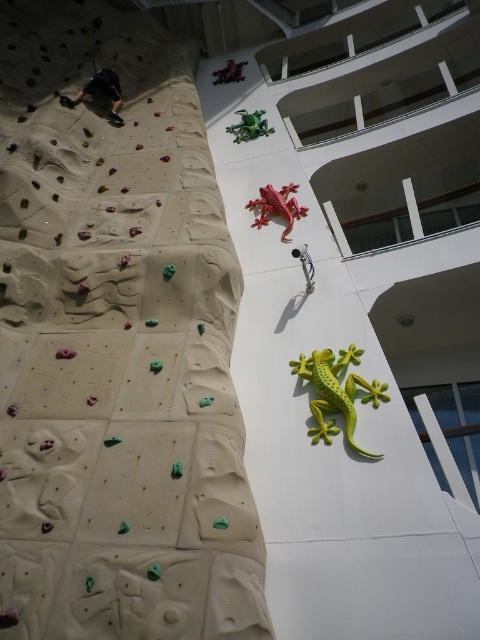
Is green matte lizard at center-right taller than rubberized red lizard at center?

In fact, green matte lizard at center-right may be shorter than rubberized red lizard at center.

Is green matte lizard at center-right in front of rubberized red lizard at center?

That is True.

This screenshot has width=480, height=640. What do you see at coordinates (336, 392) in the screenshot?
I see `green matte lizard at center-right` at bounding box center [336, 392].

You are a GUI agent. You are given a task and a screenshot of the screen. Output one action in this format:
    pyautogui.click(x=<x>, y=<y>)
    Task: Click on the green matte lizard at center-right
    This screenshot has width=480, height=640.
    Given the screenshot: What is the action you would take?
    pyautogui.click(x=336, y=392)